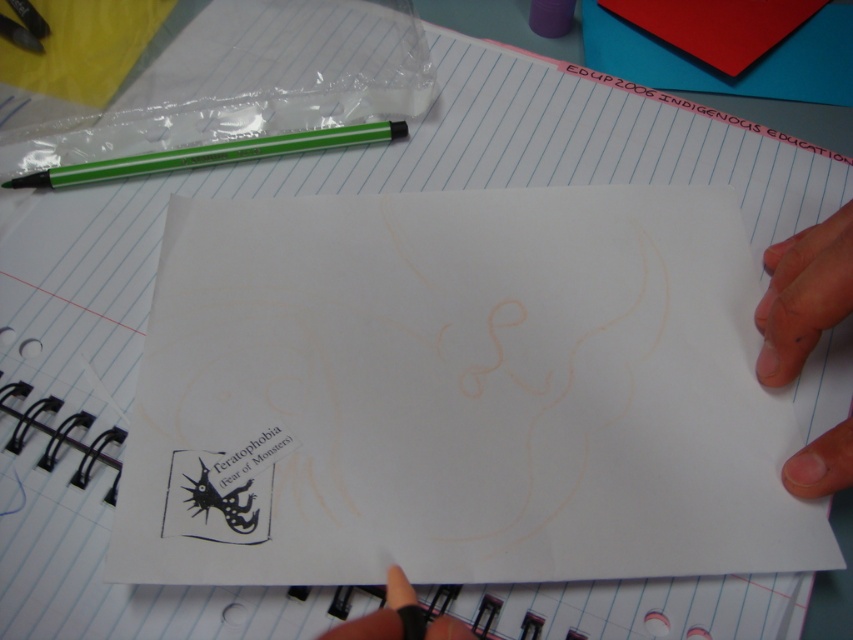
Question: Which of these objects is positioned closest to the green plastic pen at upper left?

Choices:
 (A) dry skin at lower right
 (B) white paper at center

Answer: (B)

Question: Is white paper at center closer to the viewer compared to dry skin at lower right?

Choices:
 (A) no
 (B) yes

Answer: (B)

Question: Can you confirm if white paper at center is positioned below dry skin at lower right?

Choices:
 (A) yes
 (B) no

Answer: (A)

Question: Can you confirm if white paper at center is thinner than green plastic pen at upper left?

Choices:
 (A) no
 (B) yes

Answer: (A)

Question: Among these objects, which one is nearest to the camera?

Choices:
 (A) green plastic pen at upper left
 (B) black matte finger at lower center
 (C) dry skin at lower right
 (D) white paper at center

Answer: (B)

Question: Which point is farther from the camera taking this photo?

Choices:
 (A) (194, 371)
 (B) (196, 163)

Answer: (B)